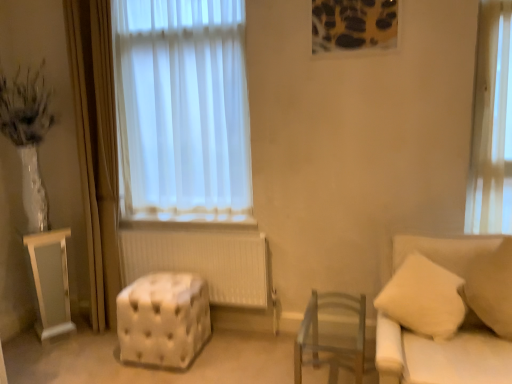
What do you see at coordinates (492, 288) in the screenshot? Image resolution: width=512 pixels, height=384 pixels. I see `beige fabric pillow at right` at bounding box center [492, 288].

Where is `beige fabric pillow at right`? The width and height of the screenshot is (512, 384). beige fabric pillow at right is located at coordinates (492, 288).

From a real-world perspective, between white fabric couch at right and clear wood chair at center, who is vertically lower?

clear wood chair at center, from a real-world perspective.

Is white fabric couch at right far from clear wood chair at center?

No.

Can you confirm if white fabric couch at right is taller than clear wood chair at center?

Correct, white fabric couch at right is much taller as clear wood chair at center.

Is white fabric couch at right oriented towards clear wood chair at center?

No, white fabric couch at right does not turn towards clear wood chair at center.

Which object is further away from the camera, white glossy cabinet at left or beige fabric pillow at right?

Positioned behind is white glossy cabinet at left.

How many degrees apart are the facing directions of white glossy cabinet at left and beige fabric pillow at right?

45.1 degrees.

Is white glossy cabinet at left facing away from beige fabric pillow at right?

That's not correct — white glossy cabinet at left is not looking away from beige fabric pillow at right.

What are the coordinates of `pillow behind the clear wood chair at center` in the screenshot? It's located at (492, 288).

In the scene shown: From a real-world perspective, is clear wood chair at center located higher than beige fabric pillow at right?

No, from a real-world perspective, clear wood chair at center is not on top of beige fabric pillow at right.

From the image's perspective, is clear wood chair at center above beige fabric pillow at right?

Incorrect, from the image's perspective, clear wood chair at center is lower than beige fabric pillow at right.

Who is taller, clear wood chair at center or beige fabric pillow at right?

beige fabric pillow at right is taller.

In the scene shown: From a real-world perspective, who is located higher, beige fabric pillow at right or white fabric couch at right?

beige fabric pillow at right.

From the image's perspective, relative to white fabric couch at right, is beige fabric pillow at right above or below?

From the image's perspective, beige fabric pillow at right appears above white fabric couch at right.

Locate an element on the screen. The image size is (512, 384). pillow positioned vertically above the white fabric couch at right (from a real-world perspective) is located at coordinates (492, 288).

Measure the distance between beige fabric pillow at right and white fabric couch at right.

beige fabric pillow at right is 10.28 inches from white fabric couch at right.

Are white fabric couch at right and white glossy cabinet at left far apart?

Yes, white fabric couch at right and white glossy cabinet at left are quite far apart.

Which is farther, (x=497, y=237) or (x=58, y=247)?

The point (x=58, y=247) is behind.

Between white fabric couch at right and white glossy cabinet at left, which one has less height?

white glossy cabinet at left.

Is white fabric couch at right facing away from white glossy cabinet at left?

white fabric couch at right is not turned away from white glossy cabinet at left.

Between point (27, 235) and point (347, 308), which one is positioned behind?

Point (27, 235)

Is white glossy cabinet at left bigger than clear wood chair at center?

No.

Who is more distant, white glossy cabinet at left or clear wood chair at center?

white glossy cabinet at left.

The image size is (512, 384). Find the location of `furniture located in front of the white glossy cabinet at left`. furniture located in front of the white glossy cabinet at left is located at coordinates (332, 331).

Is clear wood chair at center aimed at white fabric couch at right?

No, clear wood chair at center is not turned towards white fabric couch at right.

Is clear wood chair at center further to camera compared to white fabric couch at right?

Yes, it is.

Is clear wood chair at center inside or outside of white fabric couch at right?

clear wood chair at center is not enclosed by white fabric couch at right.

Consider the image. Can you confirm if clear wood chair at center is positioned to the left of white fabric couch at right?

Yes.

Locate an element on the screen. This screenshot has height=384, width=512. furniture lying below the white fabric couch at right (from the image's perspective) is located at coordinates (332, 331).

Where is `table behind the beige fabric pillow at right`? This screenshot has width=512, height=384. table behind the beige fabric pillow at right is located at coordinates (50, 281).

Based on the photo, when comparing their distances from white fabric couch at right, does white glossy cabinet at left or clear wood chair at center seem closer?

The object closer to white fabric couch at right is clear wood chair at center.

Based on their spatial positions, is white fabric couch at right or white glossy cabinet at left further from white tufted ottoman at center?

The object further to white tufted ottoman at center is white fabric couch at right.

Which object lies further to the anchor point white fabric couch at right, beige fabric pillow at right or clear wood chair at center?

clear wood chair at center lies further to white fabric couch at right than the other object.

From the image, which object appears to be farther from white glossy cabinet at left, white tufted ottoman at center or clear wood chair at center?

clear wood chair at center is positioned further to the anchor white glossy cabinet at left.

Based on their spatial positions, is white glossy cabinet at left or clear wood chair at center closer to white tufted ottoman at center?

Based on the image, white glossy cabinet at left appears to be nearer to white tufted ottoman at center.

When comparing their distances from white tufted ottoman at center, does beige fabric pillow at right or white fabric couch at right seem closer?

Among the two, white fabric couch at right is located nearer to white tufted ottoman at center.

Based on their spatial positions, is clear wood chair at center or beige fabric pillow at right closer to white tufted ottoman at center?

clear wood chair at center.

Estimate the real-world distances between objects in this image. Which object is closer to white glossy cabinet at left, beige fabric pillow at right or white fabric couch at right?

white fabric couch at right is positioned closer to the anchor white glossy cabinet at left.

This screenshot has width=512, height=384. I want to click on stool between white glossy cabinet at left and white fabric couch at right, so click(163, 319).

You are a GUI agent. You are given a task and a screenshot of the screen. Output one action in this format:
    pyautogui.click(x=<x>, y=<y>)
    Task: Click on the studio couch between clear wood chair at center and beige fabric pillow at right
    The height and width of the screenshot is (384, 512).
    Given the screenshot: What is the action you would take?
    pyautogui.click(x=441, y=355)

Find the location of a particular element. furniture situated between white tufted ottoman at center and white fabric couch at right from left to right is located at coordinates (332, 331).

Find the location of a particular element. The height and width of the screenshot is (384, 512). furniture between white tufted ottoman at center and beige fabric pillow at right from left to right is located at coordinates (332, 331).